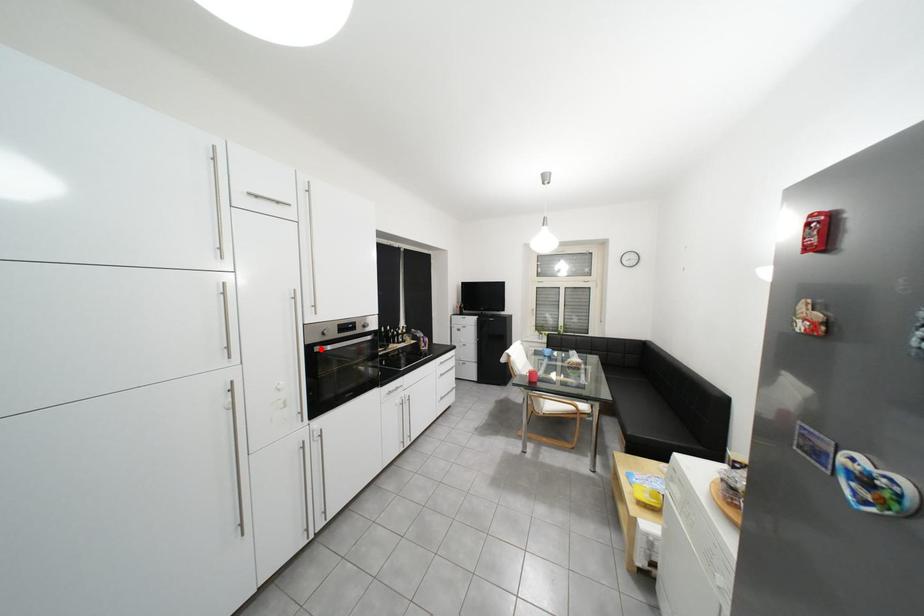
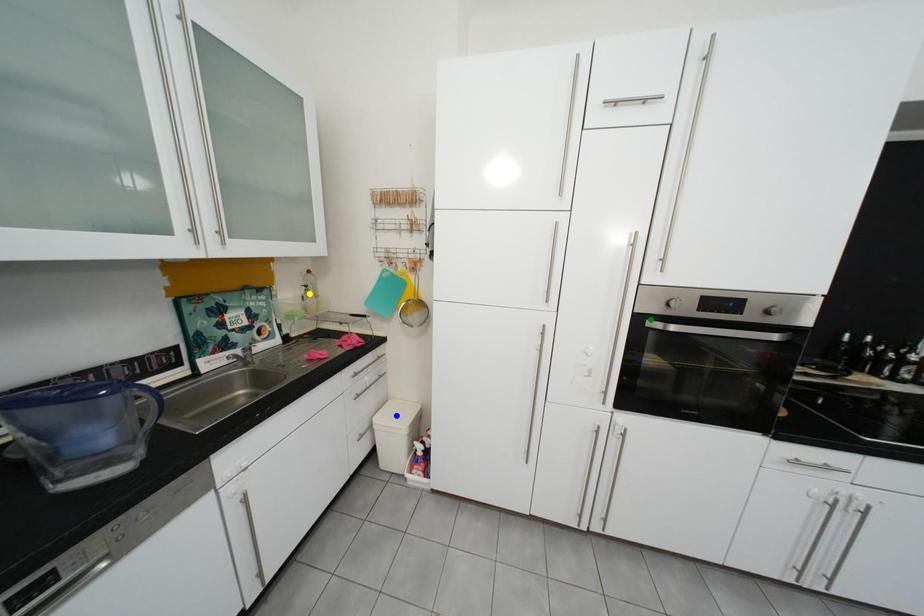
Question: I am providing you with two images of the same scene from different viewpoints. A red point is marked on the first image. You are given multiple points on the second image. Which spot in image 2 lines up with the point in image 1?

Choices:
 (A) blue point
 (B) yellow point
 (C) green point

Answer: (C)